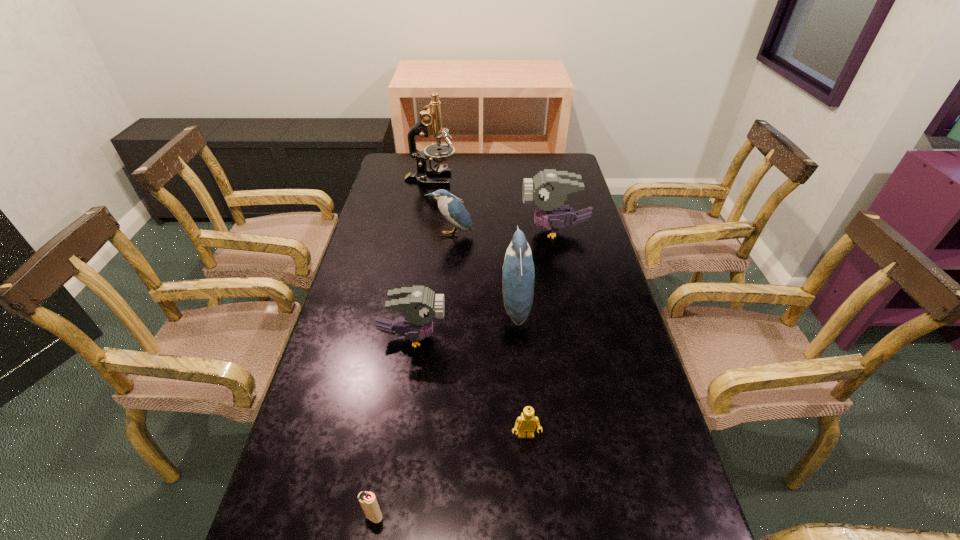
At what (x,y) coordinates should I click in order to perform the action: click on gray microscope. Please return your answer as a coordinate pair (x, y). This screenshot has height=540, width=960. Looking at the image, I should click on (430, 122).

I want to click on microscope, so click(x=430, y=122).

This screenshot has width=960, height=540. I want to click on the nearer blue bird, so click(518, 274).

Locate an element on the screen. the right blue bird is located at coordinates (518, 274).

At what (x,y) coordinates should I click in order to perform the action: click on the bigger gray bird. Please return your answer as a coordinate pair (x, y). Looking at the image, I should click on (549, 188).

At what (x,y) coordinates should I click in order to perform the action: click on the right gray bird. Please return your answer as a coordinate pair (x, y). Looking at the image, I should click on (549, 188).

Locate an element on the screen. Image resolution: width=960 pixels, height=540 pixels. the left blue bird is located at coordinates (452, 209).

The width and height of the screenshot is (960, 540). I want to click on the smaller blue bird, so click(452, 209).

This screenshot has height=540, width=960. I want to click on the left gray bird, so click(419, 305).

At what (x,y) coordinates should I click in order to perform the action: click on the nearer gray bird. Please return your answer as a coordinate pair (x, y). The image size is (960, 540). Looking at the image, I should click on (419, 305).